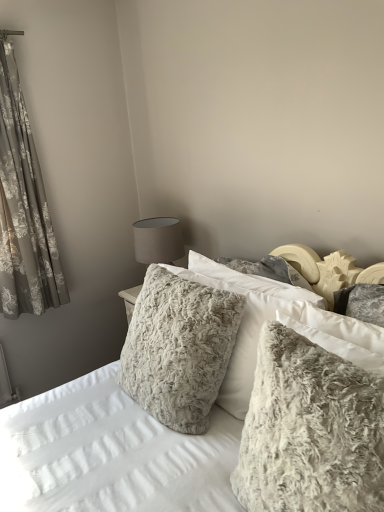
Locate an element on the screen. This screenshot has width=384, height=512. fuzzy white pillow at center, the first pillow when ordered from back to front is located at coordinates (179, 348).

At what (x,y) coordinates should I click in order to perform the action: click on fuzzy white pillow at center, the 2th pillow from the front. Please return your answer as a coordinate pair (x, y). Looking at the image, I should click on (179, 348).

Looking at this image, based on their positions, is floral-patterned fabric at left located to the left or right of fuzzy gray pillow at center?

floral-patterned fabric at left is to the left of fuzzy gray pillow at center.

Considering the positions of points (42, 222) and (90, 414), is point (42, 222) closer to camera compared to point (90, 414)?

That is False.

Which of these two, floral-patterned fabric at left or fuzzy gray pillow at center, stands taller?

floral-patterned fabric at left is taller.

From the image's perspective, is fuzzy gray pillow at center over fuzzy white pillow at center, the 2th pillow from the front?

Actually, fuzzy gray pillow at center appears below fuzzy white pillow at center, the 2th pillow from the front, in the image.

From a real-world perspective, is fuzzy gray pillow at center physically above fuzzy white pillow at center, the first pillow when ordered from back to front?

No, from a real-world perspective, fuzzy gray pillow at center is not on top of fuzzy white pillow at center, the first pillow when ordered from back to front.

From their relative heights in the image, would you say fuzzy gray pillow at center is taller or shorter than fuzzy white pillow at center, the 2th pillow from the front?

Considering their sizes, fuzzy gray pillow at center has more height than fuzzy white pillow at center, the 2th pillow from the front.

The width and height of the screenshot is (384, 512). In order to click on pillow lying above the fuzzy gray pillow at center (from the image's perspective) in this screenshot , I will do `click(179, 348)`.

From the picture: Between fuzzy white pillow at center, the first pillow when ordered from back to front, and fuzzy gray pillow at center, which one has larger size?

fuzzy gray pillow at center is bigger.

Which is further, (138,378) or (357,352)?

The point (138,378) is behind.

Between fuzzy white pillow at center, the first pillow when ordered from back to front, and fuzzy gray pillow at center, which one is positioned in front?

Positioned in front is fuzzy gray pillow at center.

I want to click on pillow in front of the fuzzy white pillow at center, the 2th pillow from the front, so click(x=310, y=430).

From a real-world perspective, is fuzzy white pillow at center, the first pillow when ordered from back to front, physically below fuzzy gray pillow at center, the 2th pillow viewed from the back?

Yes, from a real-world perspective, fuzzy white pillow at center, the first pillow when ordered from back to front, is beneath fuzzy gray pillow at center, the 2th pillow viewed from the back.

Is fuzzy white pillow at center, the first pillow when ordered from back to front, wider than fuzzy gray pillow at center, the 2th pillow viewed from the back?

Yes.

Between fuzzy white pillow at center, the 2th pillow from the front, and fuzzy gray pillow at center, the 2th pillow viewed from the back, which one has less height?

Standing shorter between the two is fuzzy gray pillow at center, the 2th pillow viewed from the back.

From the image's perspective, which one is positioned higher, floral-patterned fabric at left or fuzzy white pillow at center, the 2th pillow from the front?

floral-patterned fabric at left.

Is floral-patterned fabric at left smaller than fuzzy white pillow at center, the 2th pillow from the front?

Yes, floral-patterned fabric at left is smaller than fuzzy white pillow at center, the 2th pillow from the front.

From a real-world perspective, is floral-patterned fabric at left above or below fuzzy white pillow at center, the first pillow when ordered from back to front?

From a real-world perspective, floral-patterned fabric at left is physically above fuzzy white pillow at center, the first pillow when ordered from back to front.

Considering the sizes of floral-patterned fabric at left and fuzzy white pillow at center, the first pillow when ordered from back to front, in the image, is floral-patterned fabric at left wider or thinner than fuzzy white pillow at center, the first pillow when ordered from back to front,?

In the image, floral-patterned fabric at left appears to be more narrow than fuzzy white pillow at center, the first pillow when ordered from back to front.

Can you confirm if fuzzy gray pillow at center, the 2th pillow viewed from the back, is bigger than floral-patterned fabric at left?

Incorrect, fuzzy gray pillow at center, the 2th pillow viewed from the back, is not larger than floral-patterned fabric at left.

From a real-world perspective, is fuzzy gray pillow at center, positioned as the 1th pillow in front-to-back order, under floral-patterned fabric at left?

Indeed, from a real-world perspective, fuzzy gray pillow at center, positioned as the 1th pillow in front-to-back order, is positioned beneath floral-patterned fabric at left.

Is fuzzy gray pillow at center with fuzzy gray pillow at center, positioned as the 1th pillow in front-to-back order?

fuzzy gray pillow at center is not next to fuzzy gray pillow at center, positioned as the 1th pillow in front-to-back order, and they're not touching.

Is fuzzy gray pillow at center turned away from fuzzy gray pillow at center, the 2th pillow viewed from the back?

No.

Considering the relative sizes of fuzzy gray pillow at center and fuzzy gray pillow at center, positioned as the 1th pillow in front-to-back order, in the image provided, is fuzzy gray pillow at center shorter than fuzzy gray pillow at center, positioned as the 1th pillow in front-to-back order,?

No, fuzzy gray pillow at center is not shorter than fuzzy gray pillow at center, positioned as the 1th pillow in front-to-back order.

Is fuzzy gray pillow at center completely or partially outside of fuzzy gray pillow at center, the 2th pillow viewed from the back?

Absolutely, fuzzy gray pillow at center is external to fuzzy gray pillow at center, the 2th pillow viewed from the back.

The height and width of the screenshot is (512, 384). Identify the location of bed lying on the right of floral-patterned fabric at left. (155, 422).

Find the location of `bed in front of the fuzzy white pillow at center, the 2th pillow from the front`. bed in front of the fuzzy white pillow at center, the 2th pillow from the front is located at coordinates (155, 422).

Looking at the image, which one is located closer to fuzzy white pillow at center, the 2th pillow from the front, floral-patterned fabric at left or fuzzy gray pillow at center, positioned as the 1th pillow in front-to-back order?

fuzzy gray pillow at center, positioned as the 1th pillow in front-to-back order, lies closer to fuzzy white pillow at center, the 2th pillow from the front, than the other object.

When comparing their distances from floral-patterned fabric at left, does fuzzy gray pillow at center, positioned as the 1th pillow in front-to-back order, or fuzzy white pillow at center, the first pillow when ordered from back to front, seem further?

fuzzy gray pillow at center, positioned as the 1th pillow in front-to-back order, lies further to floral-patterned fabric at left than the other object.

When comparing their distances from fuzzy gray pillow at center, does fuzzy white pillow at center, the 2th pillow from the front, or fuzzy gray pillow at center, positioned as the 1th pillow in front-to-back order, seem further?

fuzzy gray pillow at center, positioned as the 1th pillow in front-to-back order.

When comparing their distances from fuzzy white pillow at center, the first pillow when ordered from back to front, does floral-patterned fabric at left or fuzzy gray pillow at center seem further?

Among the two, floral-patterned fabric at left is located further to fuzzy white pillow at center, the first pillow when ordered from back to front.

Based on their spatial positions, is fuzzy gray pillow at center or fuzzy gray pillow at center, positioned as the 1th pillow in front-to-back order, further from floral-patterned fabric at left?

fuzzy gray pillow at center, positioned as the 1th pillow in front-to-back order.

Estimate the real-world distances between objects in this image. Which object is closer to fuzzy white pillow at center, the first pillow when ordered from back to front, fuzzy gray pillow at center, the 2th pillow viewed from the back, or floral-patterned fabric at left?

Based on the image, fuzzy gray pillow at center, the 2th pillow viewed from the back, appears to be nearer to fuzzy white pillow at center, the first pillow when ordered from back to front.

Which object lies nearer to the anchor point fuzzy gray pillow at center, positioned as the 1th pillow in front-to-back order, fuzzy white pillow at center, the first pillow when ordered from back to front, or floral-patterned fabric at left?

fuzzy white pillow at center, the first pillow when ordered from back to front, is closer to fuzzy gray pillow at center, positioned as the 1th pillow in front-to-back order.

Looking at the image, which one is located further to fuzzy gray pillow at center, the 2th pillow viewed from the back, fuzzy gray pillow at center or floral-patterned fabric at left?

floral-patterned fabric at left lies further to fuzzy gray pillow at center, the 2th pillow viewed from the back, than the other object.

Locate an element on the screen. Image resolution: width=384 pixels, height=512 pixels. pillow between floral-patterned fabric at left and fuzzy gray pillow at center, the 2th pillow viewed from the back, in the horizontal direction is located at coordinates (179, 348).

What are the coordinates of `pillow between fuzzy gray pillow at center and fuzzy white pillow at center, the first pillow when ordered from back to front, from front to back` in the screenshot? It's located at (310, 430).